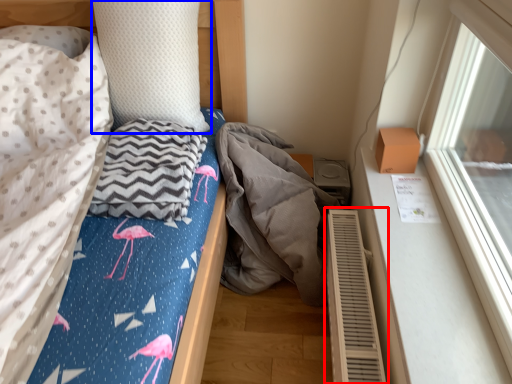
Question: Among these objects, which one is nearest to the camera, air conditioner (highlighted by a red box) or pillow (highlighted by a blue box)?

Choices:
 (A) air conditioner
 (B) pillow

Answer: (A)